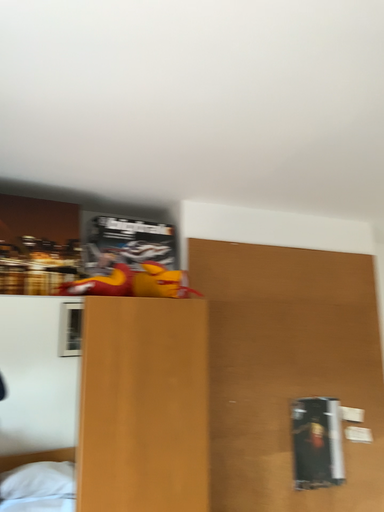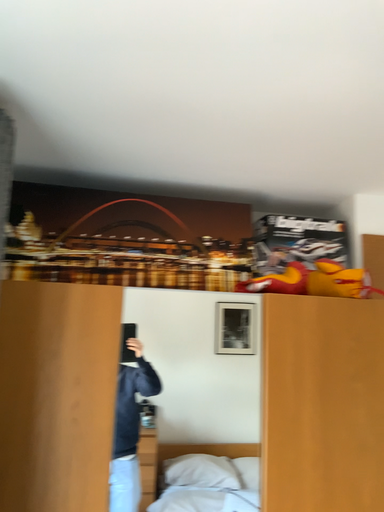
Question: How did the camera likely rotate when shooting the video?

Choices:
 (A) rotated right
 (B) rotated left

Answer: (B)